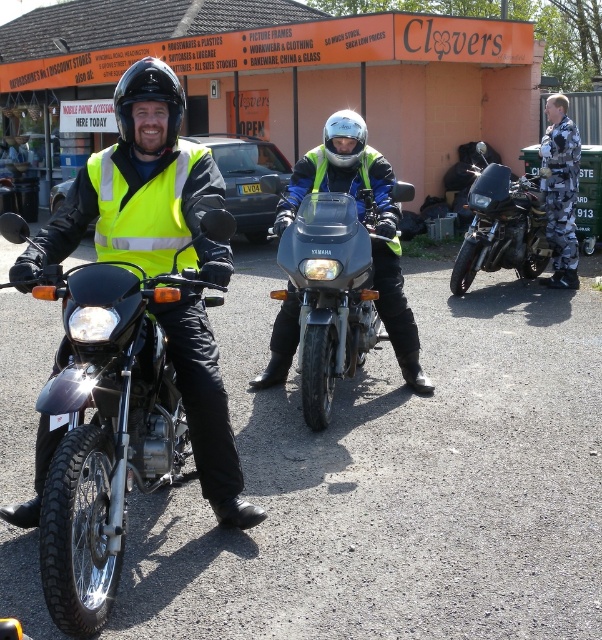
You are standing at the center of the parking lot and want to locate the shiny black motorcycle at right. According to the coordinates provided, in which direction should you move to find it?

The shiny black motorcycle at right is located at coordinates point (501, 227). Since you are at the center, you should move towards the right side of the parking lot to find it.

You are a photographer standing in the parking lot and want to take a photo of the shiny black motorcycle at right and the glossy white helmet at center. Based on their positions, which object is located to the right of the other?

The shiny black motorcycle at right is positioned on the right side of the glossy white helmet at center, so the motorcycle is to the right of the helmet.